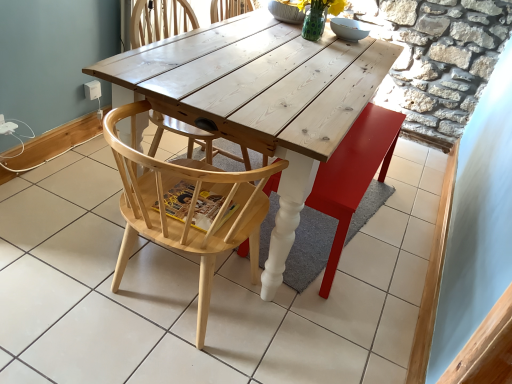
You are a GUI agent. You are given a task and a screenshot of the screen. Output one action in this format:
    pyautogui.click(x=<x>, y=<y>)
    Task: Click on the free spot below natural wood chair at center, the 1th chair viewed from the front (from a real-world perspective)
    
    Given the screenshot: What is the action you would take?
    pyautogui.click(x=174, y=301)